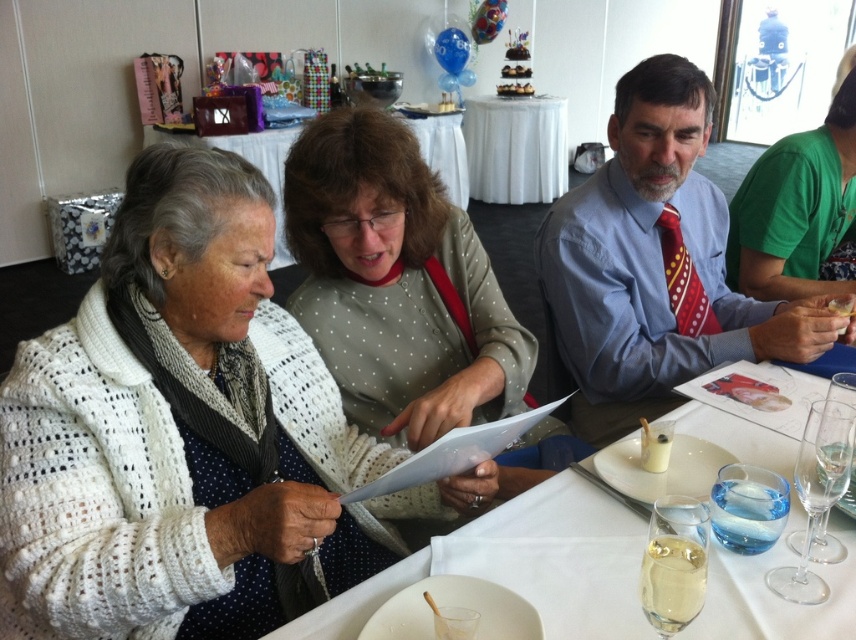
Question: Among these points, which one is farthest from the camera?

Choices:
 (A) (391, 140)
 (B) (800, 500)

Answer: (A)

Question: Is green cotton shirt at upper right positioned before transparent glass wine glass at lower right?

Choices:
 (A) no
 (B) yes

Answer: (A)

Question: Which object is closer to the camera taking this photo?

Choices:
 (A) white knitted sweater at center
 (B) white cloth table at upper center
 (C) green cotton shirt at upper right

Answer: (A)

Question: Does white knitted sweater at center come behind light brown dotted sweater at center?

Choices:
 (A) no
 (B) yes

Answer: (A)

Question: Is clear glass wine glass at lower center in front of transparent glass wine glass at lower right?

Choices:
 (A) no
 (B) yes

Answer: (B)

Question: Estimate the real-world distances between objects in this image. Which object is closer to the green cotton shirt at upper right?

Choices:
 (A) white knitted sweater at center
 (B) white cloth table at upper center
 (C) transparent glass wine glass at lower right
 (D) blue shirt at center

Answer: (D)